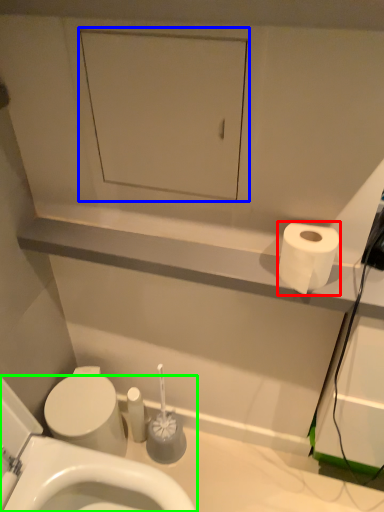
Question: Considering the real-world distances, which object is farthest from toilet paper (highlighted by a red box)? medicine cabinet (highlighted by a blue box) or toilet (highlighted by a green box)?

Choices:
 (A) medicine cabinet
 (B) toilet

Answer: (B)